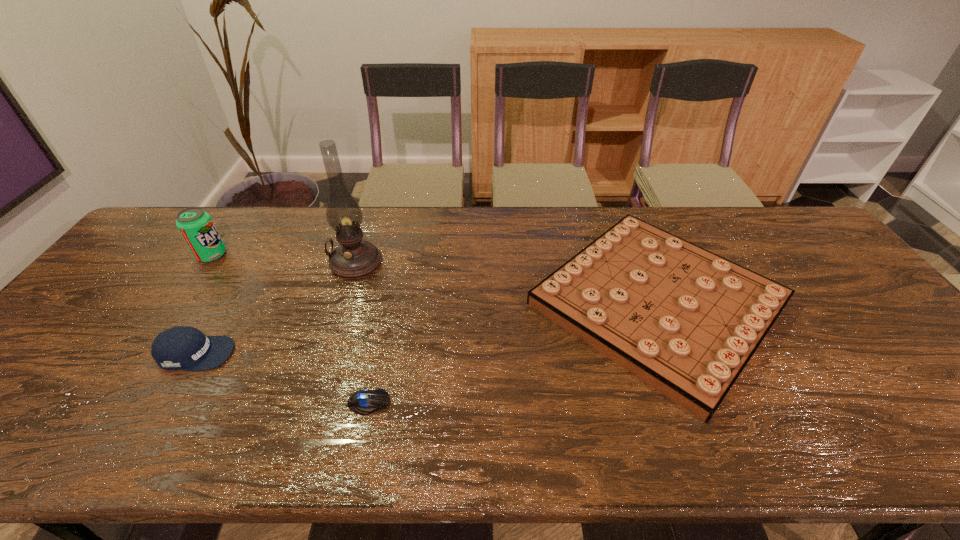
Where is `free space located 0.390m on the front-facing side of the baseball cap`? Image resolution: width=960 pixels, height=540 pixels. free space located 0.390m on the front-facing side of the baseball cap is located at coordinates (392, 353).

What are the coordinates of `vacant space situated on the right of the fourth tallest object` in the screenshot? It's located at (857, 303).

Find the location of `vacant space positioned 0.400m on the button side of the second object from right to left`. vacant space positioned 0.400m on the button side of the second object from right to left is located at coordinates (569, 402).

Locate an element on the screen. This screenshot has width=960, height=540. oil lamp at the far edge is located at coordinates (353, 258).

At what (x,y) coordinates should I click in order to perform the action: click on pop soda at the far edge. Please return your answer as a coordinate pair (x, y). Looking at the image, I should click on (195, 225).

Find the location of a particular element. The width and height of the screenshot is (960, 540). gameboard present at the far edge is located at coordinates (686, 321).

Where is `object located at the near edge`? object located at the near edge is located at coordinates (686, 321).

Where is `free spot at the far edge of the desktop`? This screenshot has width=960, height=540. free spot at the far edge of the desktop is located at coordinates (281, 218).

Where is `vacant position at the near edge of the desktop`? vacant position at the near edge of the desktop is located at coordinates click(910, 457).

I want to click on vacant space at the left edge, so click(x=158, y=275).